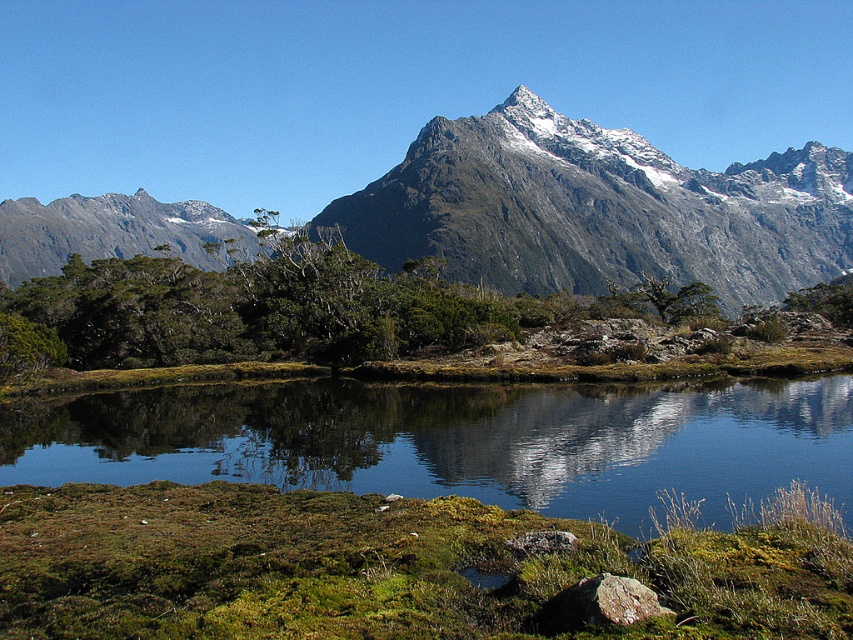
You are standing at the edge of the lake in the serene natural landscape. You notice a point marked at coordinates (456, 442). What can you find at that location?

At point (456, 442) lies clear water at center.

You are standing at the point labeled as point (548, 260) in the image. A friend is located 212.94 meters away from you. Based on the scene, where might your friend be positioned relative to the landscape?

Your friend is positioned 212.94 meters away from point (548, 260), which is likely near the calm lake in the middle ground since the distance aligns with the spatial arrangement described.